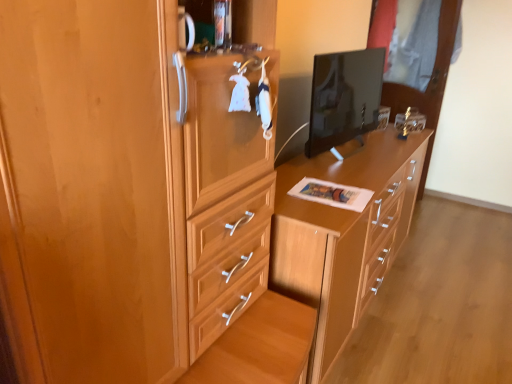
Question: Is matte wood cabinet at center at the left side of wooden chest of drawers at center?

Choices:
 (A) yes
 (B) no

Answer: (A)

Question: Is matte wood cabinet at center in contact with wooden chest of drawers at center?

Choices:
 (A) no
 (B) yes

Answer: (A)

Question: Can you confirm if matte wood cabinet at center is shorter than wooden chest of drawers at center?

Choices:
 (A) yes
 (B) no

Answer: (B)

Question: Is wooden chest of drawers at center at the back of matte wood cabinet at center?

Choices:
 (A) yes
 (B) no

Answer: (B)

Question: Is wooden chest of drawers at center a part of matte wood cabinet at center?

Choices:
 (A) no
 (B) yes

Answer: (A)

Question: From the image's perspective, is matte wood cabinet at center on top of wooden chest of drawers at center?

Choices:
 (A) yes
 (B) no

Answer: (B)

Question: Can we say matte black monitor at center lies outside wooden chest of drawers at center?

Choices:
 (A) no
 (B) yes

Answer: (B)

Question: Does matte black monitor at center have a greater height compared to wooden chest of drawers at center?

Choices:
 (A) no
 (B) yes

Answer: (A)

Question: Is matte black monitor at center to the right of wooden chest of drawers at center from the viewer's perspective?

Choices:
 (A) yes
 (B) no

Answer: (B)

Question: Does matte black monitor at center have a lesser width compared to wooden chest of drawers at center?

Choices:
 (A) no
 (B) yes

Answer: (B)

Question: Can you confirm if matte black monitor at center is wider than wooden chest of drawers at center?

Choices:
 (A) yes
 (B) no

Answer: (B)

Question: Does matte black monitor at center turn towards wooden chest of drawers at center?

Choices:
 (A) yes
 (B) no

Answer: (B)

Question: Can you confirm if wooden chest of drawers at center is positioned to the right of transparent glass door at upper right?

Choices:
 (A) yes
 (B) no

Answer: (B)